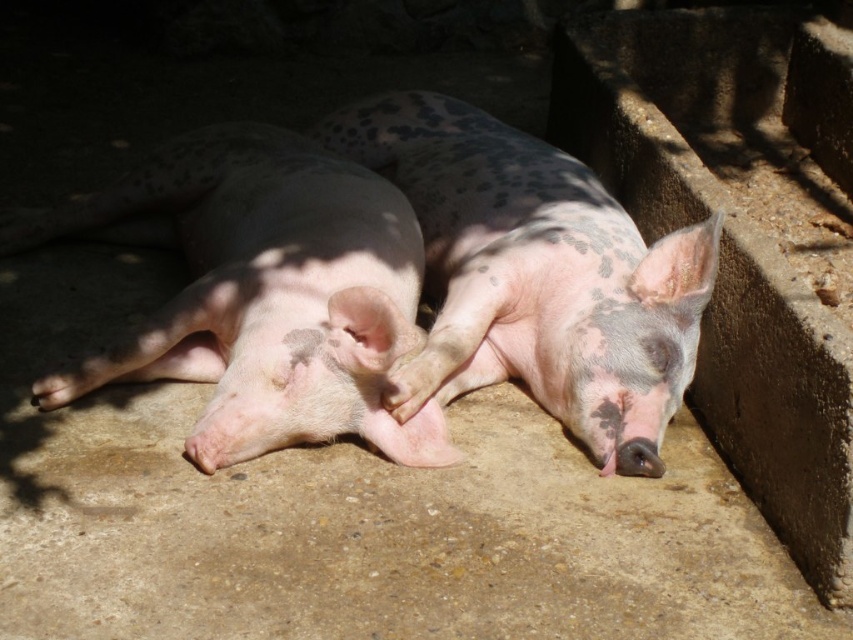
Question: Does pink matte pig at center have a smaller size compared to pink matte/speckled pig at center?

Choices:
 (A) yes
 (B) no

Answer: (A)

Question: Does pink matte pig at center have a lesser width compared to pink matte/speckled pig at center?

Choices:
 (A) yes
 (B) no

Answer: (B)

Question: Which of the following is the farthest from the observer?

Choices:
 (A) (196, 308)
 (B) (706, 230)

Answer: (A)

Question: Which point is closer to the camera?

Choices:
 (A) pink matte/speckled pig at center
 (B) pink matte pig at center

Answer: (B)

Question: Is pink matte pig at center positioned in front of pink matte/speckled pig at center?

Choices:
 (A) yes
 (B) no

Answer: (A)